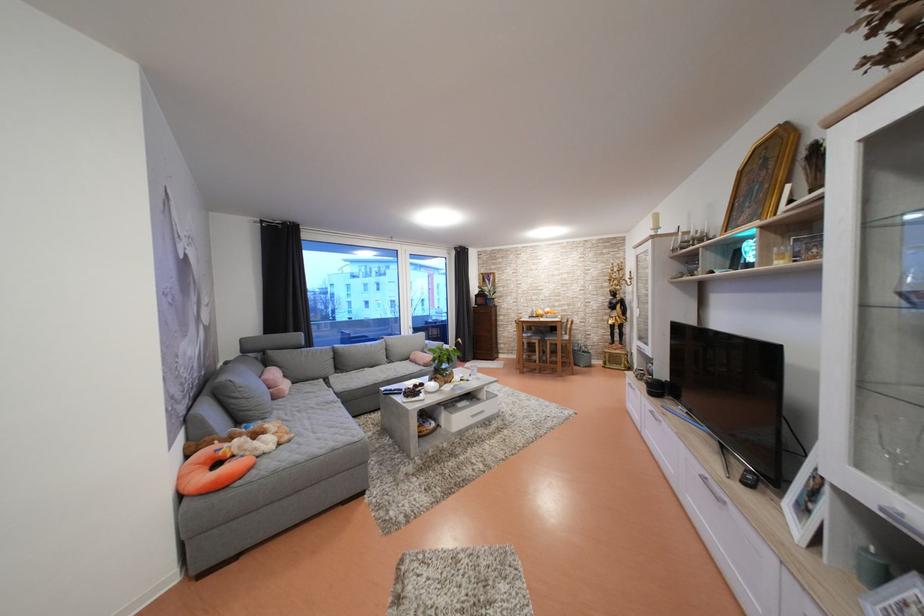
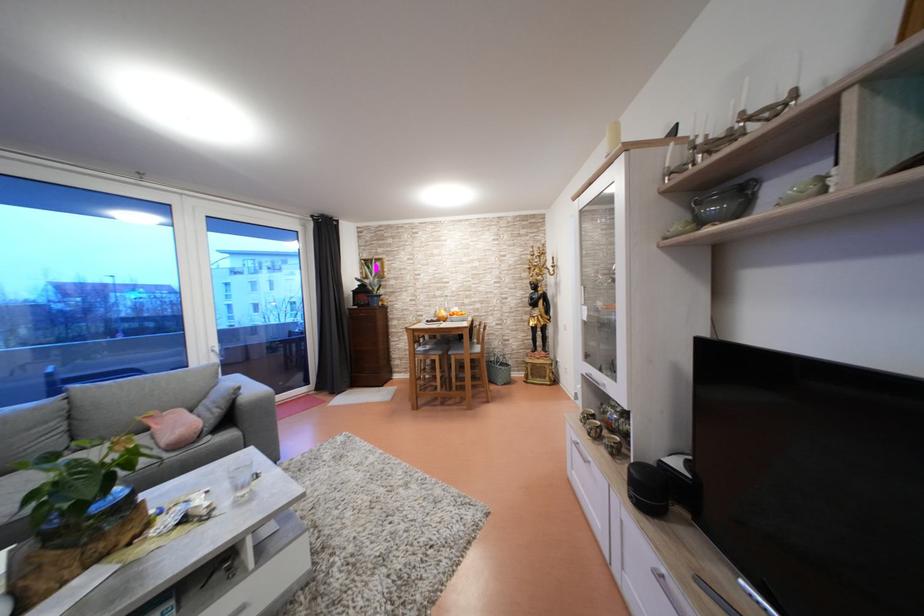
Find the pixel in the second image that matches point 664,395 in the first image.

(662, 500)